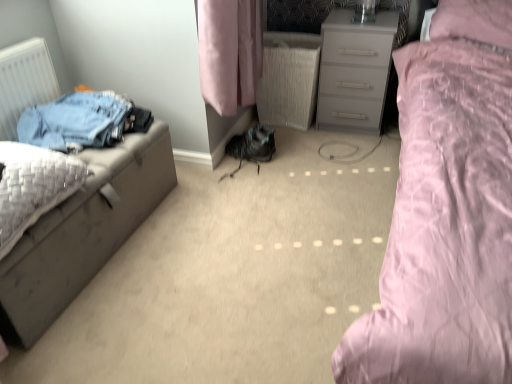
Question: Can you confirm if matte gray chest of drawers at center is positioned to the right of white matte radiator at left?

Choices:
 (A) yes
 (B) no

Answer: (A)

Question: Is matte gray chest of drawers at center in front of white matte radiator at left?

Choices:
 (A) no
 (B) yes

Answer: (A)

Question: Does matte gray chest of drawers at center have a lesser height compared to white matte radiator at left?

Choices:
 (A) no
 (B) yes

Answer: (A)

Question: From a real-world perspective, is matte gray chest of drawers at center beneath white matte radiator at left?

Choices:
 (A) no
 (B) yes

Answer: (B)

Question: Is white matte radiator at left at the back of matte gray chest of drawers at center?

Choices:
 (A) yes
 (B) no

Answer: (B)

Question: Relative to matte gray nightstand at left, is white matte radiator at left in front or behind?

Choices:
 (A) front
 (B) behind

Answer: (B)

Question: From a real-world perspective, is white matte radiator at left above or below matte gray nightstand at left?

Choices:
 (A) below
 (B) above

Answer: (B)

Question: Is white matte radiator at left situated inside matte gray nightstand at left or outside?

Choices:
 (A) outside
 (B) inside

Answer: (A)

Question: Considering the positions of white matte radiator at left and matte gray nightstand at left in the image, is white matte radiator at left taller or shorter than matte gray nightstand at left?

Choices:
 (A) short
 (B) tall

Answer: (B)

Question: In terms of width, does matte gray nightstand at left look wider or thinner when compared to pink satin bed at right?

Choices:
 (A) wide
 (B) thin

Answer: (B)

Question: Is matte gray nightstand at left taller or shorter than pink satin bed at right?

Choices:
 (A) short
 (B) tall

Answer: (A)

Question: Is matte gray nightstand at left inside or outside of pink satin bed at right?

Choices:
 (A) inside
 (B) outside

Answer: (B)

Question: Considering their positions, is matte gray nightstand at left located in front of or behind pink satin bed at right?

Choices:
 (A) front
 (B) behind

Answer: (B)

Question: Does point (432, 16) appear closer or farther from the camera than point (364, 28)?

Choices:
 (A) closer
 (B) farther

Answer: (A)

Question: In the image, is pink satin bed at right positioned in front of or behind matte gray chest of drawers at center?

Choices:
 (A) front
 (B) behind

Answer: (A)